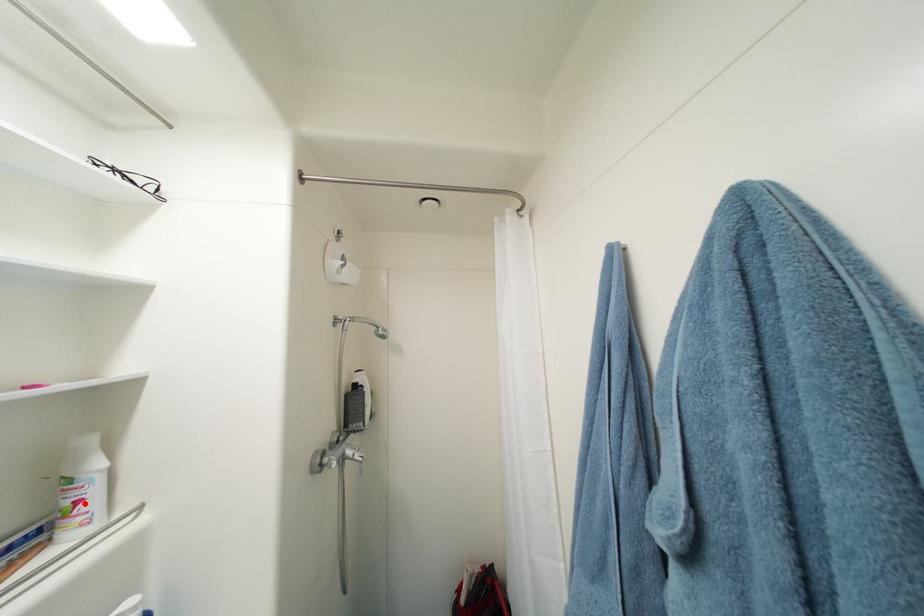
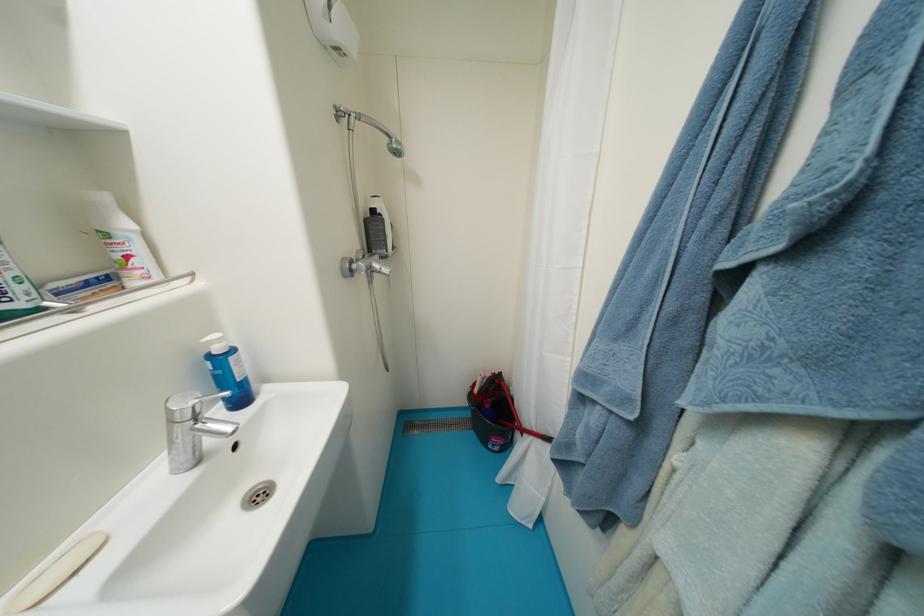
Locate, in the second image, the point that corresponds to the highlighted location in the first image.

(134, 259)